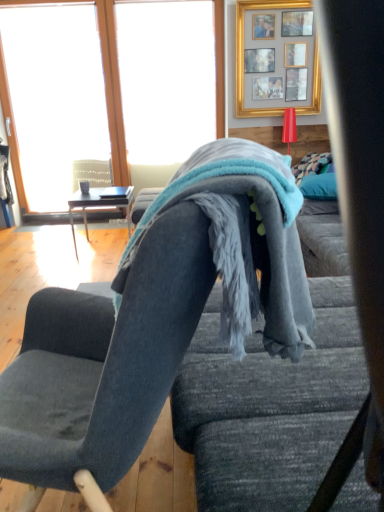
Question: From the image's perspective, is soft blue fleece blanket at center on transparent glass window at upper left?

Choices:
 (A) yes
 (B) no

Answer: (B)

Question: Can you confirm if soft blue fleece blanket at center is wider than transparent glass window at upper left?

Choices:
 (A) no
 (B) yes

Answer: (B)

Question: Can you confirm if soft blue fleece blanket at center is smaller than transparent glass window at upper left?

Choices:
 (A) yes
 (B) no

Answer: (A)

Question: Is soft blue fleece blanket at center far away from transparent glass window at upper left?

Choices:
 (A) no
 (B) yes

Answer: (B)

Question: Is soft blue fleece blanket at center facing away from transparent glass window at upper left?

Choices:
 (A) no
 (B) yes

Answer: (A)

Question: From the image's perspective, is soft blue fleece blanket at center located above or below wooden glossy table at left?

Choices:
 (A) above
 (B) below

Answer: (B)

Question: Considering the positions of soft blue fleece blanket at center and wooden glossy table at left in the image, is soft blue fleece blanket at center wider or thinner than wooden glossy table at left?

Choices:
 (A) wide
 (B) thin

Answer: (B)

Question: Is point (244, 276) positioned closer to the camera than point (69, 210)?

Choices:
 (A) closer
 (B) farther

Answer: (A)

Question: Choose the correct answer: Is soft blue fleece blanket at center inside wooden glossy table at left or outside it?

Choices:
 (A) outside
 (B) inside

Answer: (A)

Question: Which is correct: soft blue fleece blanket at center is inside transparent glass window at upper left, or outside of it?

Choices:
 (A) outside
 (B) inside

Answer: (A)

Question: From a real-world perspective, is soft blue fleece blanket at center above or below transparent glass window at upper left?

Choices:
 (A) below
 (B) above

Answer: (A)

Question: Relative to transparent glass window at upper left, is soft blue fleece blanket at center in front or behind?

Choices:
 (A) front
 (B) behind

Answer: (A)

Question: Does point (274, 181) appear closer or farther from the camera than point (112, 92)?

Choices:
 (A) farther
 (B) closer

Answer: (B)

Question: Is gold/glass picture frame at upper center bigger or smaller than velvet dark gray chair at center?

Choices:
 (A) small
 (B) big

Answer: (A)

Question: From a real-world perspective, is gold/glass picture frame at upper center above or below velvet dark gray chair at center?

Choices:
 (A) below
 (B) above

Answer: (B)